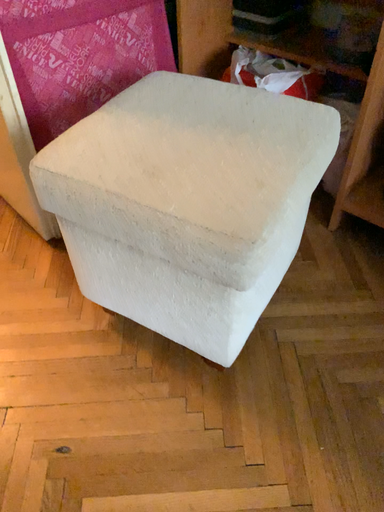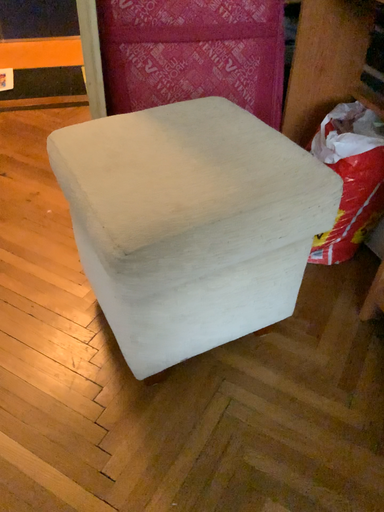
Question: How did the camera likely rotate when shooting the video?

Choices:
 (A) rotated downward
 (B) rotated upward

Answer: (B)